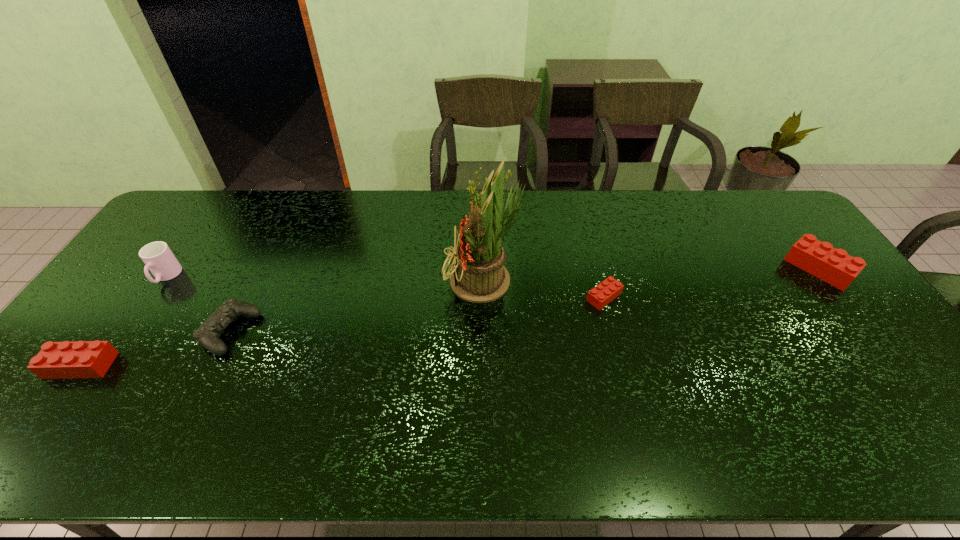
In order to click on the nearest Lego in this screenshot , I will do `click(83, 359)`.

In order to click on the second shortest Lego in this screenshot , I will do `click(83, 359)`.

Identify the location of the shortest Lego. The width and height of the screenshot is (960, 540). (609, 289).

I want to click on the second Lego from left to right, so click(609, 289).

Find the location of a particular element. The image size is (960, 540). the rightmost object is located at coordinates (834, 266).

The image size is (960, 540). I want to click on the tallest object, so click(478, 275).

Locate an element on the screen. The image size is (960, 540). the fourth object from left to right is located at coordinates (478, 275).

The width and height of the screenshot is (960, 540). What are the coordinates of `control` in the screenshot? It's located at (207, 335).

Locate an element on the screen. Image resolution: width=960 pixels, height=540 pixels. cup is located at coordinates (157, 256).

The height and width of the screenshot is (540, 960). What are the coordinates of `free space located 0.390m on the right of the leftmost Lego` in the screenshot? It's located at (265, 366).